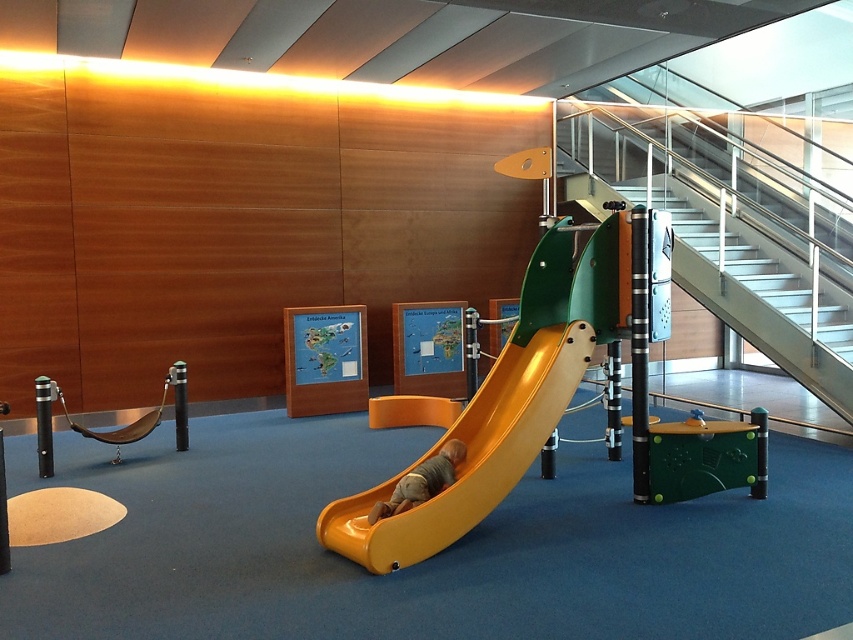
You are a parent trying to decide whether to let your child play on the yellow matte slide at center or climb the metallic silver stairs at upper right. Considering the width of the two structures, which one is wider?

The metallic silver stairs at upper right is wider than the yellow matte slide at center.

You are a parent trying to carry a large box that is 1.2 meters wide. You need to move from the entrance to the play area to the stairs. The entrance is near the slide. Can you pass through the area between the metallic silver stairs at upper right and the smooth yellow slide at center without tilting the box?

The metallic silver stairs at upper right is wider than the smooth yellow slide at center. Since the box is 1.2 meters wide, you need to check the narrowest point between them. If the narrowest part is at least 1.2 meters, you can pass. However, since the stairs are wider, the narrowest point might be near the slide. Without exact measurements, it is uncertain, but the description only states the stairs are wider, not the total space. Therefore, it is safer to assume the path might be too narrow for the box

You are a parent trying to guide your child to the metallic silver stairs at upper right. The child is currently at the yellow matte slide at center. Which direction should you tell the child to go to reach the stairs?

The yellow matte slide at center is in front of the metallic silver stairs at upper right, so the child should move backward away from the slide towards the stairs.